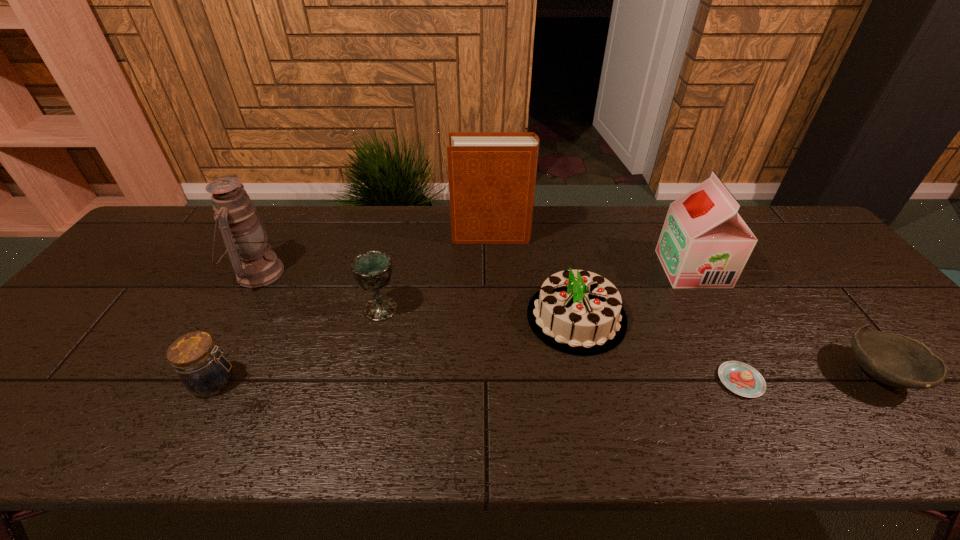
The width and height of the screenshot is (960, 540). Identify the location of free space located 0.350m on the open cover of the farthest object. (342, 235).

Where is `vacant space located on the open cover of the farthest object`? vacant space located on the open cover of the farthest object is located at coordinates (415, 235).

The width and height of the screenshot is (960, 540). I want to click on blank space located on the front of the oil lamp, so click(230, 321).

Locate an element on the screen. The image size is (960, 540). blank space located with the cap open on the soya milk is located at coordinates (566, 268).

This screenshot has height=540, width=960. Identify the location of blank space located 0.370m with the cap open on the soya milk. (536, 268).

At what (x,y) coordinates should I click in order to perform the action: click on free spot located 0.390m with the cap open on the soya milk. Please return your answer as a coordinate pair (x, y). This screenshot has width=960, height=540. Looking at the image, I should click on (529, 268).

Find the location of `free space located 0.350m on the left of the birthday cake`. free space located 0.350m on the left of the birthday cake is located at coordinates (391, 317).

Identify the location of vacant region located on the right of the chalice. Image resolution: width=960 pixels, height=540 pixels. (544, 309).

Where is `blank area located 0.350m on the lid of the third shortest object`? blank area located 0.350m on the lid of the third shortest object is located at coordinates (395, 382).

At what (x,y) coordinates should I click in order to perform the action: click on vacant space located on the back of the rightmost object. Please return your answer as a coordinate pair (x, y). The width and height of the screenshot is (960, 540). Looking at the image, I should click on click(x=838, y=323).